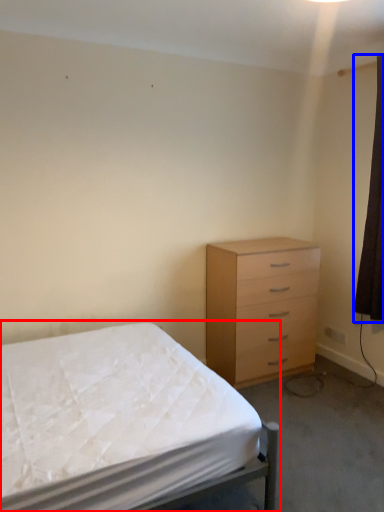
Question: Among these objects, which one is farthest to the camera, bed (highlighted by a red box) or curtain (highlighted by a blue box)?

Choices:
 (A) bed
 (B) curtain

Answer: (B)